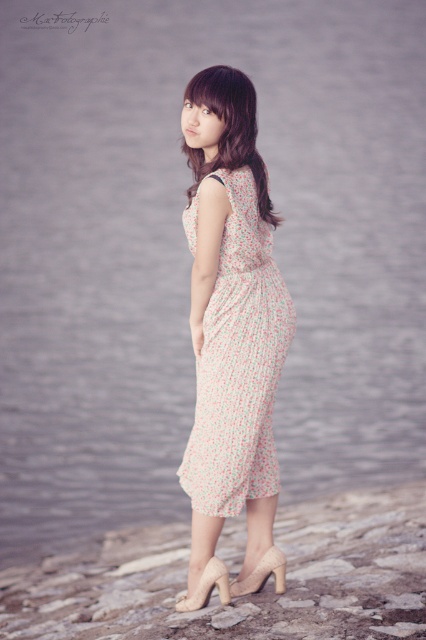
Who is taller, floral chiffon dress at center or beige suede high-heeled sandal at lower center?

Standing taller between the two is floral chiffon dress at center.

Measure the distance between floral chiffon dress at center and beige suede high-heeled sandal at lower center.

floral chiffon dress at center is 69.47 centimeters away from beige suede high-heeled sandal at lower center.

In the scene shown: Who is more distant from viewer, (259, 244) or (180, 609)?

Point (180, 609)

Find the location of a particular element. floral chiffon dress at center is located at coordinates (238, 364).

Who is more forward, [189,237] or [195,193]?

Point [189,237]

Between floral chiffon dress at center and floral fabric dress at center, which one has less height?

With less height is floral fabric dress at center.

Image resolution: width=426 pixels, height=640 pixels. Identify the location of floral chiffon dress at center. (238, 364).

Where is `floral chiffon dress at center`? This screenshot has height=640, width=426. floral chiffon dress at center is located at coordinates (238, 364).

The width and height of the screenshot is (426, 640). What do you see at coordinates (238, 364) in the screenshot?
I see `floral chiffon dress at center` at bounding box center [238, 364].

Between floral chiffon dress at center and suede beige high-heeled shoe at lower center, which one has less height?

suede beige high-heeled shoe at lower center

Find the location of a particular element. floral chiffon dress at center is located at coordinates (238, 364).